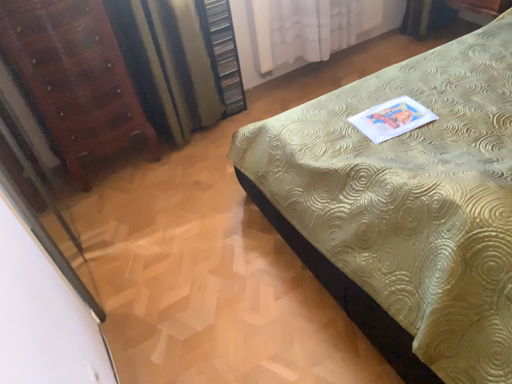
The width and height of the screenshot is (512, 384). Find the location of `free area behind transparent glass screen door at left`. free area behind transparent glass screen door at left is located at coordinates (126, 203).